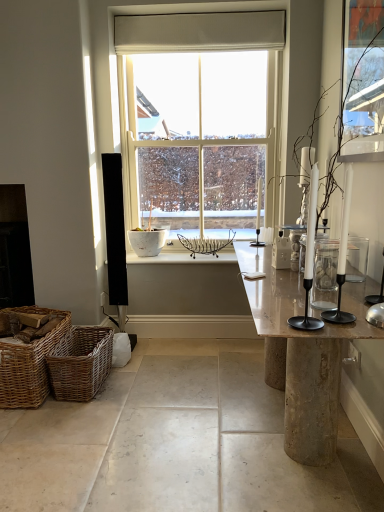
Where is `vacant area on top of smooth concrete table at lower center (from a real-world perspective)`? vacant area on top of smooth concrete table at lower center (from a real-world perspective) is located at coordinates (163, 396).